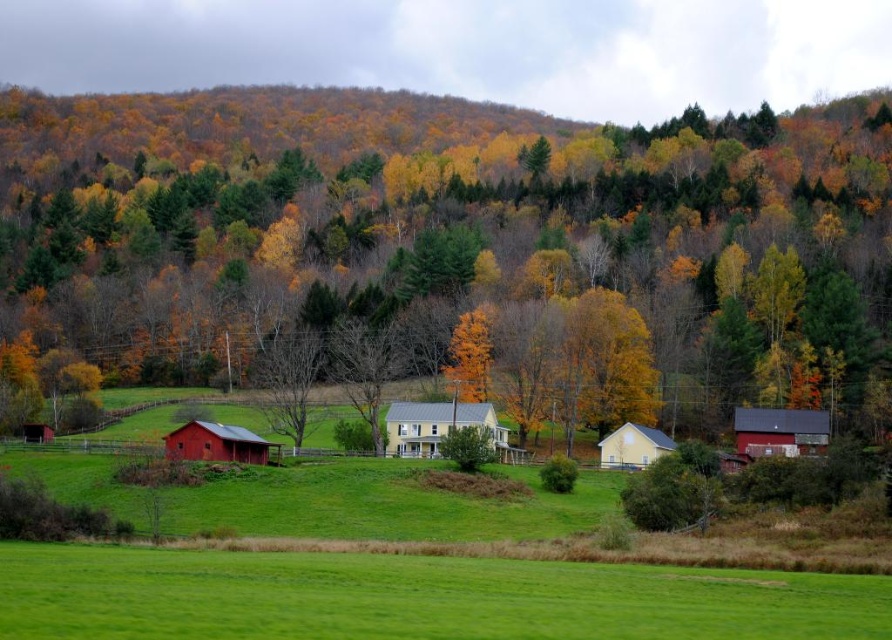
You are a drone operator who needs to fly a drone from the matte yellow tree at center to the yellow matte house at center. Given that your drone has a maximum flight range of 200 feet, will it be able to reach the house from the tree without needing to recharge?

The distance between the matte yellow tree at center and the yellow matte house at center is 234.66 feet. Since the drone can only fly 200 feet before needing to recharge, it will not be able to reach the house from the tree without recharging.

You are a farmer standing in the middle of the field looking towards the farm buildings. You see the bare wood tree at center and the matte yellow barn at center. Which object is positioned to the left when facing the farm buildings?

The bare wood tree at center is to the left of the matte yellow barn at center when facing the farm buildings.

You are an aerial photographer planning to capture a clear view of the yellow matte house at center and the matte yellow tree at center from above. Which object will appear closer to the camera in the photo?

The matte yellow tree at center will appear closer to the camera because the yellow matte house at center is behind it, meaning the tree is positioned in front of the house in the scene.